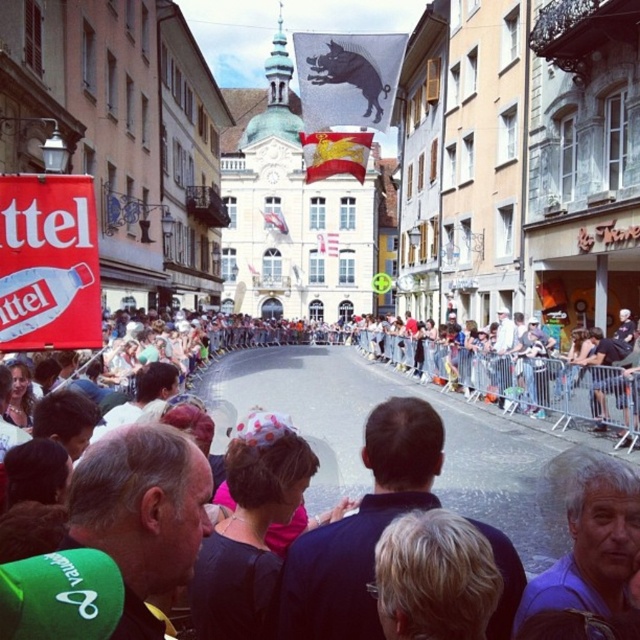
Question: Which point is closer to the camera?

Choices:
 (A) gray hair at center
 (B) white plastic sign at upper left

Answer: (A)

Question: In this image, where is white plastic sign at upper left located relative to gray hair at center?

Choices:
 (A) right
 (B) left

Answer: (B)

Question: Which of the following is the farthest from the observer?

Choices:
 (A) gray hair at center
 (B) white plastic sign at upper left
 (C) matte black banner at center

Answer: (B)

Question: Which point is closer to the camera?

Choices:
 (A) white plastic sign at upper left
 (B) matte black banner at center

Answer: (B)

Question: Does matte black banner at center come in front of gray hair at center?

Choices:
 (A) yes
 (B) no

Answer: (B)

Question: Is white plastic sign at upper left above gray hair at center?

Choices:
 (A) no
 (B) yes

Answer: (B)